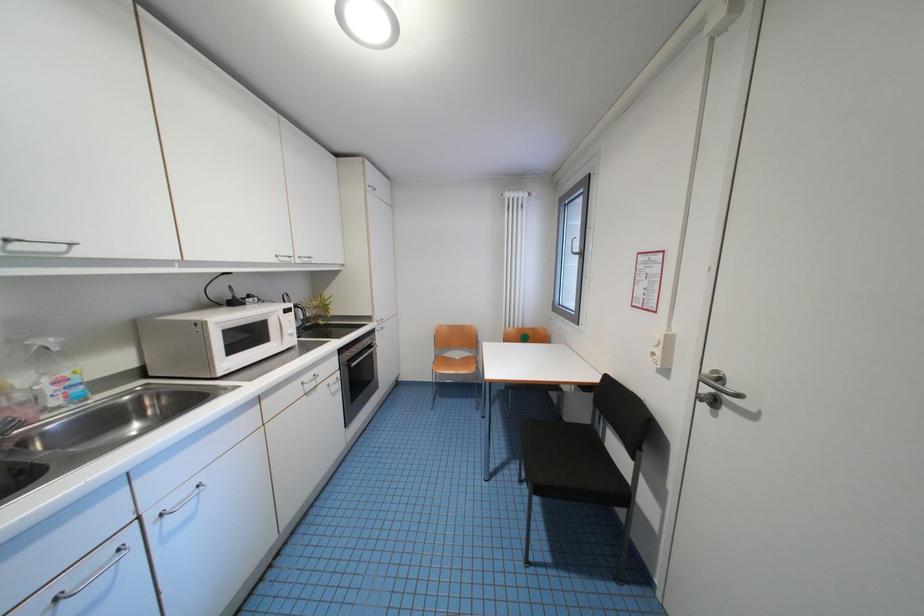
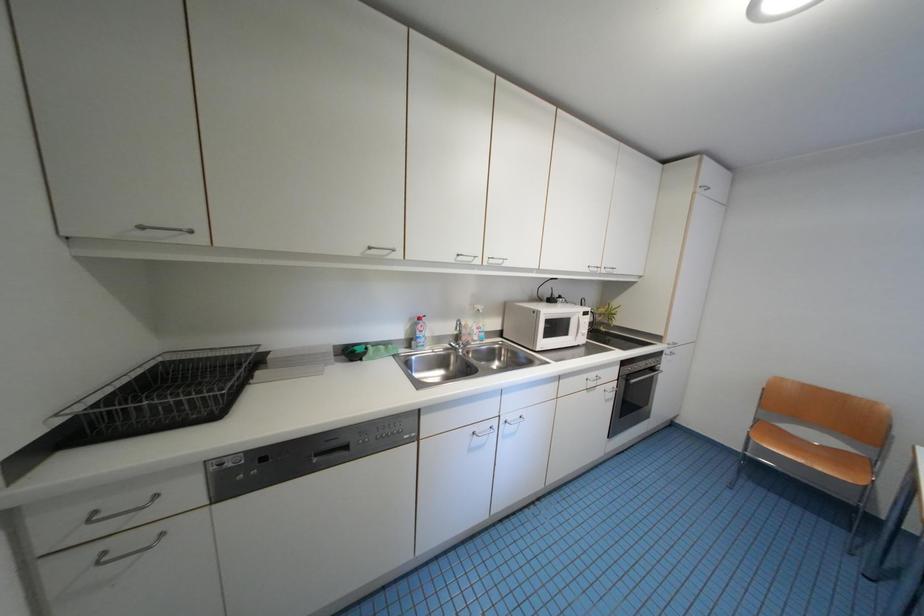
Question: The camera is either moving clockwise (left) or counter-clockwise (right) around the object. The first image is from the beginning of the video and the second image is from the end. Is the camera moving left or right when shooting the video?

Choices:
 (A) Left
 (B) Right

Answer: (B)